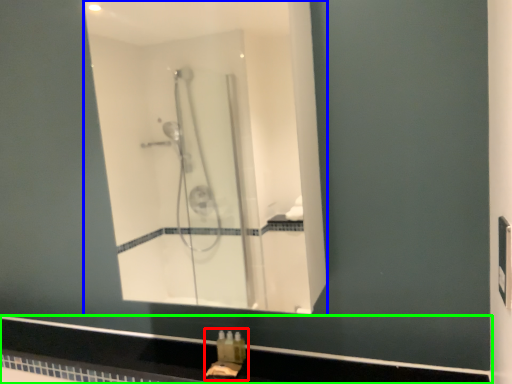
Question: Estimate the real-world distances between objects in this image. Which object is closer to sink (highlighted by a red box), mirror (highlighted by a blue box) or counter top (highlighted by a green box)?

Choices:
 (A) mirror
 (B) counter top

Answer: (B)